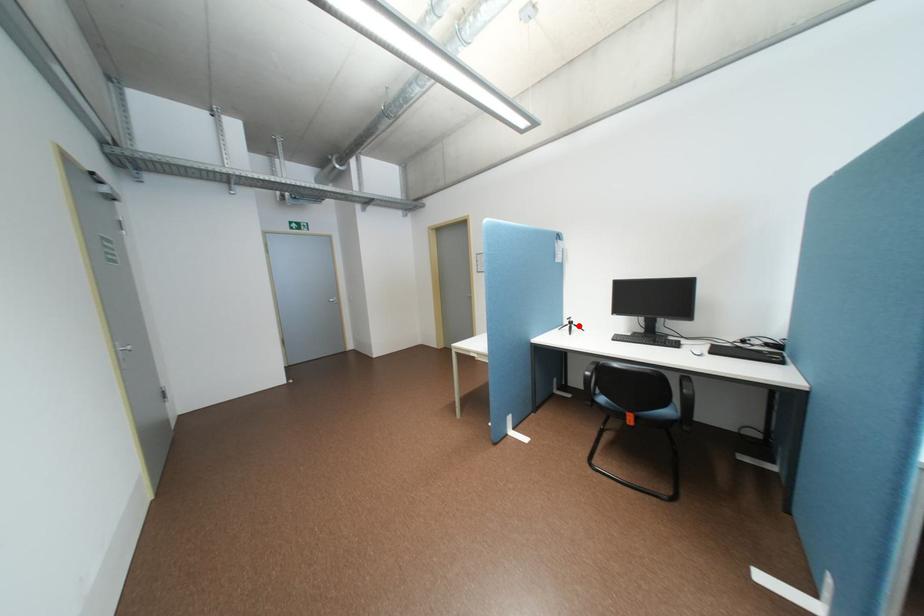
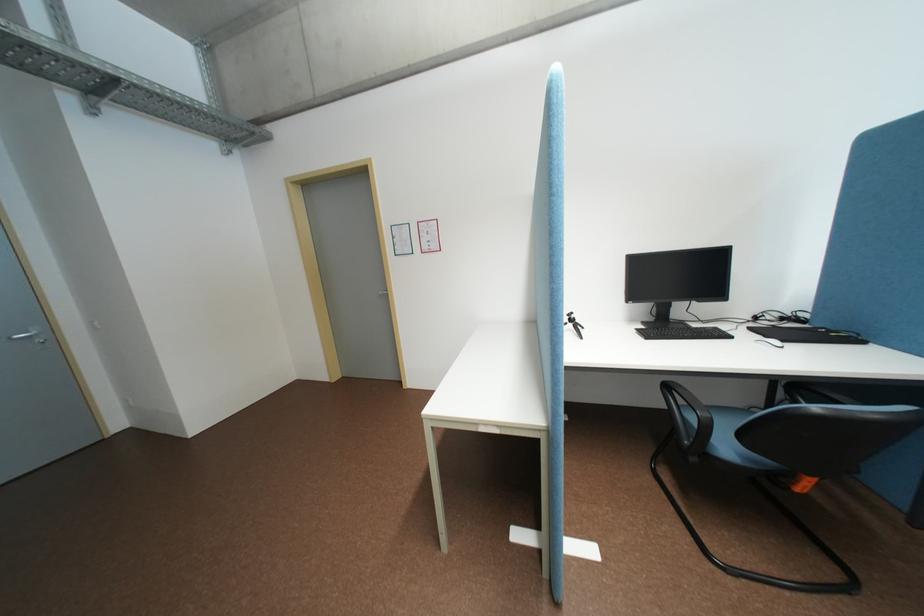
Question: I am providing you with two images of the same scene from different viewpoints. Image1 has a red point marked. In image2, the corresponding 3D location appears at what relative position? Reply with the corresponding letter.

Choices:
 (A) Closer
 (B) Farther

Answer: (B)